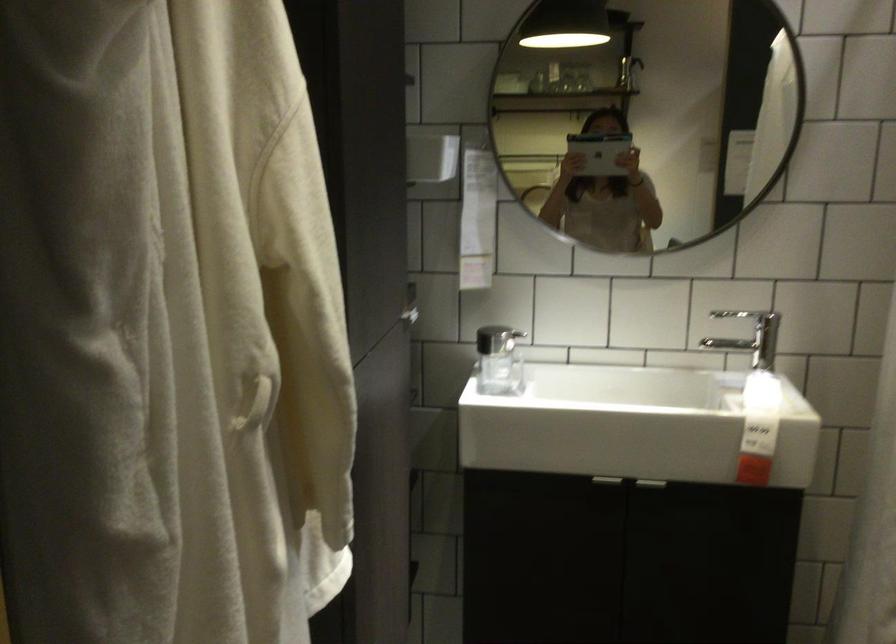
At what (x,y) coordinates should I click in order to perform the action: click on silver faucet handle. Please return your answer as a coordinate pair (x, y). The height and width of the screenshot is (644, 896). Looking at the image, I should click on tap(752, 319).